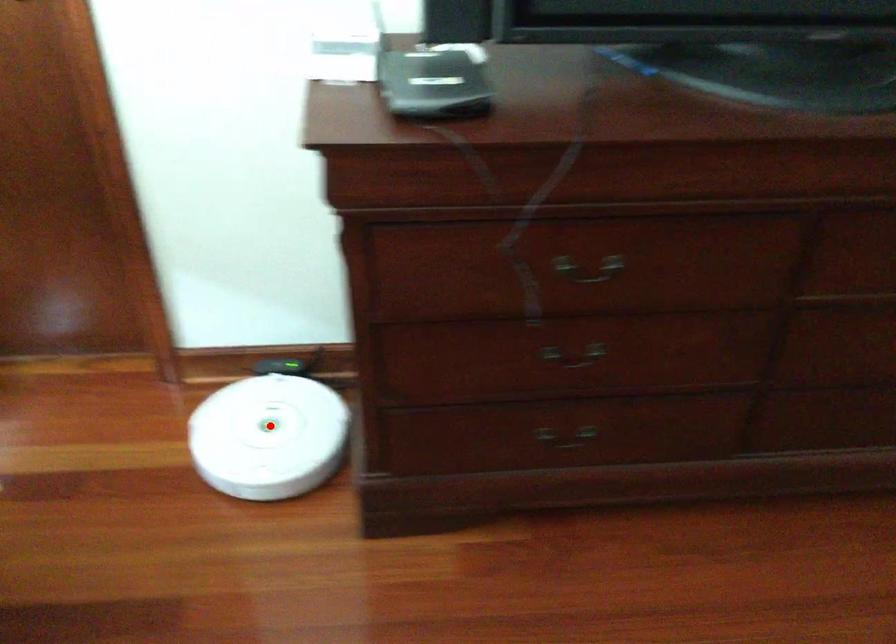
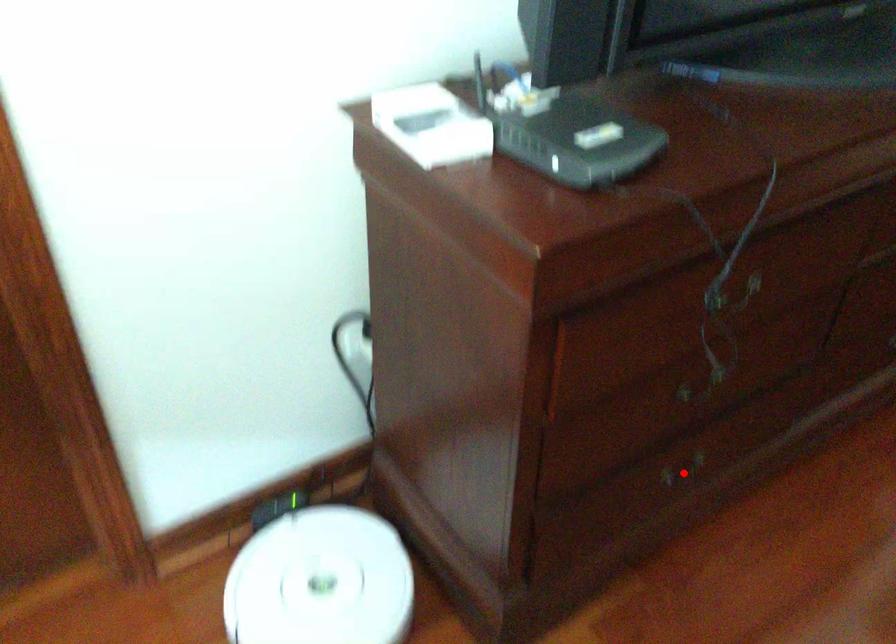
I am providing you with two images of the same scene from different viewpoints. A red point is marked on the first image and another point is marked on the second image. Is the marked point in image1 the same physical position as the marked point in image2?

No